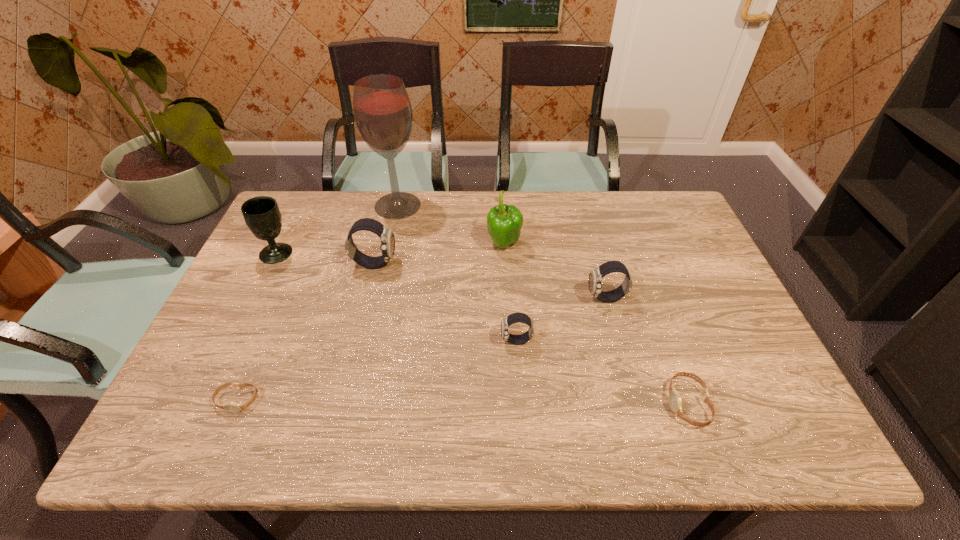
The height and width of the screenshot is (540, 960). Find the location of `blank area located on the face of the fourth shortest watch`. blank area located on the face of the fourth shortest watch is located at coordinates (456, 299).

What are the coordinates of `free region located on the face of the third nearest watch` in the screenshot? It's located at (395, 341).

Locate an element on the screen. This screenshot has width=960, height=540. free space located 0.300m on the face of the third nearest watch is located at coordinates (378, 341).

Locate an element on the screen. free region located on the face of the third nearest watch is located at coordinates (362, 341).

Where is `free space located on the face of the rightmost object`? free space located on the face of the rightmost object is located at coordinates (520, 404).

Image resolution: width=960 pixels, height=540 pixels. Find the location of `free region located on the face of the rightmost object`. free region located on the face of the rightmost object is located at coordinates (548, 404).

Identify the location of vacant space located on the face of the rightmost object. (581, 404).

Where is `vacant space located 0.070m on the face of the left beige watch`? vacant space located 0.070m on the face of the left beige watch is located at coordinates (218, 446).

Locate an element on the screen. This screenshot has width=960, height=540. alcohol that is at the far edge is located at coordinates tap(383, 114).

Find the location of a particular element. bell pepper located in the far edge section of the desktop is located at coordinates (504, 223).